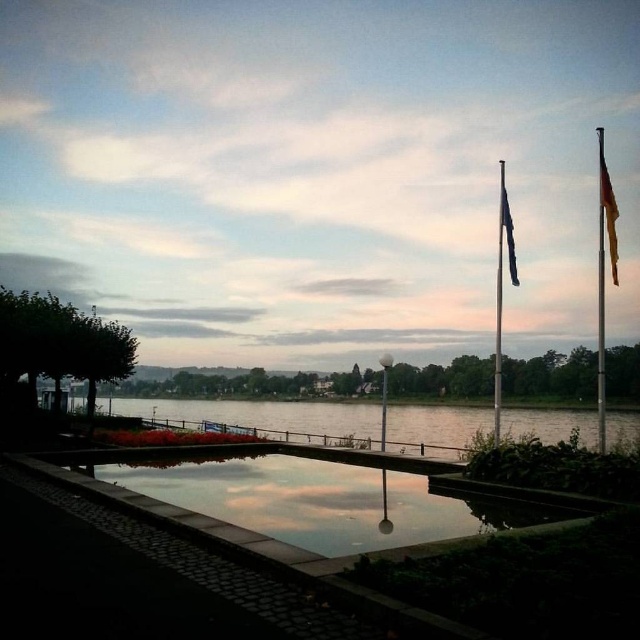
Question: Which object is closer to the camera taking this photo?

Choices:
 (A) reflective glass water at center
 (B) metallic flagpole at right
 (C) polished metal flag pole at right
 (D) blue fabric flagpole at center

Answer: (B)

Question: Which point is farther to the camera?

Choices:
 (A) (500, 188)
 (B) (378, 419)
 (C) (604, 232)

Answer: (A)

Question: From the image, what is the correct spatial relationship of reflective glass water at center in relation to blue fabric flag at upper center?

Choices:
 (A) above
 (B) below

Answer: (B)

Question: Is polished metal flag pole at right to the right of metallic flag pole at right from the viewer's perspective?

Choices:
 (A) no
 (B) yes

Answer: (B)

Question: Does metallic flagpole at right lie behind metallic flag pole at right?

Choices:
 (A) no
 (B) yes

Answer: (A)

Question: Which point is closer to the camera taking this photo?

Choices:
 (A) click(614, 198)
 (B) click(516, 276)

Answer: (A)